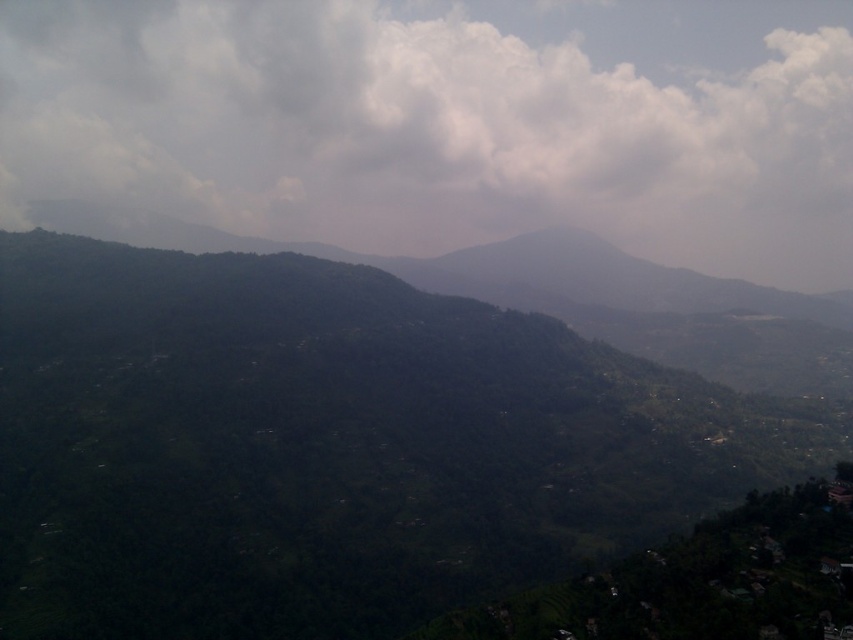
Question: Among these points, which one is nearest to the camera?

Choices:
 (A) (126, 436)
 (B) (474, 32)

Answer: (A)

Question: Does green leafy mountain at center appear over white fluffy cloud at upper center?

Choices:
 (A) no
 (B) yes

Answer: (A)

Question: Does green leafy mountain at center appear on the left side of white fluffy cloud at upper center?

Choices:
 (A) yes
 (B) no

Answer: (A)

Question: Which point is farther to the camera?

Choices:
 (A) green leafy mountain at center
 (B) white fluffy cloud at upper center

Answer: (B)

Question: Is green leafy mountain at center above white fluffy cloud at upper center?

Choices:
 (A) yes
 (B) no

Answer: (B)

Question: Among these objects, which one is nearest to the camera?

Choices:
 (A) green leafy mountain at center
 (B) white fluffy cloud at upper center

Answer: (A)